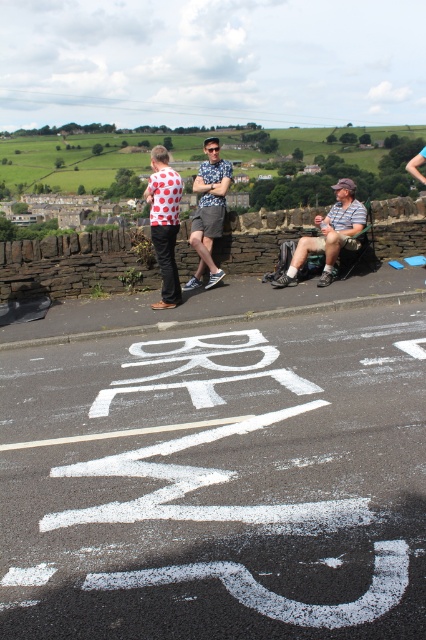
Is striped shirt at center to the right of matte gray shorts at center from the viewer's perspective?

Yes, striped shirt at center is to the right of matte gray shorts at center.

Is striped shirt at center below matte gray shorts at center?

Yes.

Which is behind, point (336, 224) or point (210, 211)?

Positioned behind is point (210, 211).

Locate an element on the screen. striped shirt at center is located at coordinates (330, 234).